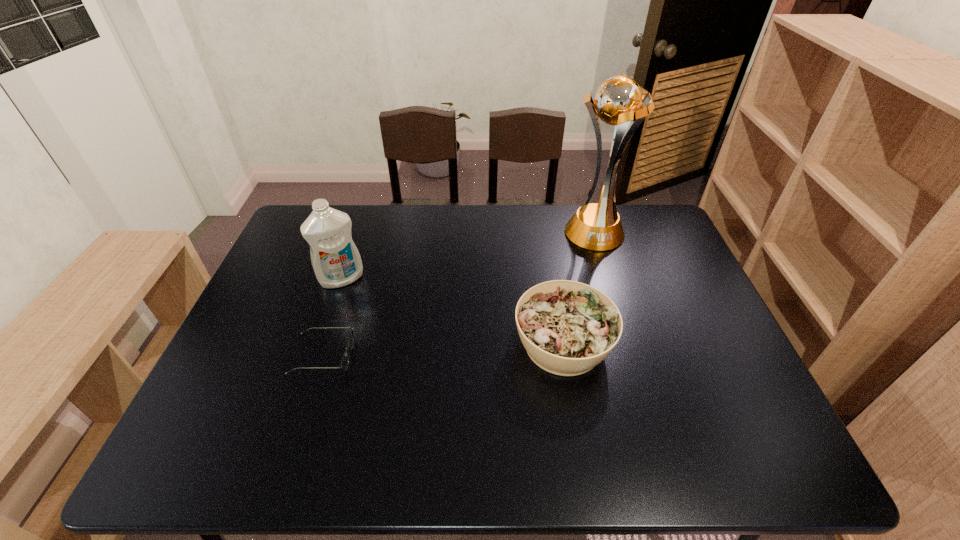
At what (x,y) coordinates should I click in order to perform the action: click on free space between the spectacles and the trophy. Please return your answer as a coordinate pair (x, y). The image size is (960, 540). Looking at the image, I should click on (458, 294).

You are a GUI agent. You are given a task and a screenshot of the screen. Output one action in this format:
    pyautogui.click(x=<x>, y=<y>)
    Task: Click on the empty space that is in between the farthest object and the second farthest object
    
    Given the screenshot: What is the action you would take?
    pyautogui.click(x=468, y=255)

Image resolution: width=960 pixels, height=540 pixels. In order to click on free space between the spectacles and the tallest object in this screenshot , I will do `click(458, 294)`.

Find the location of `free space between the tallest object and the third shortest object`. free space between the tallest object and the third shortest object is located at coordinates (468, 255).

Identify the location of blank region between the shortest object and the third nearest object. (332, 318).

The image size is (960, 540). Find the location of `free space that is in between the spectacles and the second shortest object`. free space that is in between the spectacles and the second shortest object is located at coordinates (444, 350).

Locate which object is the closest to the detergent. Please provide its 2D coordinates. Your answer should be formatted as a tuple, i.e. [(x, y)], where the tuple contains the x and y coordinates of a point satisfying the conditions above.

[(344, 364)]

This screenshot has height=540, width=960. I want to click on object that is the second closest to the spectacles, so click(567, 328).

The height and width of the screenshot is (540, 960). I want to click on blank area in the image that satisfies the following two spatial constraints: 1. on the front-facing side of the tallest object; 2. through the lenses of the spectacles, so click(631, 356).

Find the location of `blank space that satisfies the following two spatial constraints: 1. on the front-facing side of the trophy; 2. through the lenses of the spectacles`. blank space that satisfies the following two spatial constraints: 1. on the front-facing side of the trophy; 2. through the lenses of the spectacles is located at coordinates tap(631, 356).